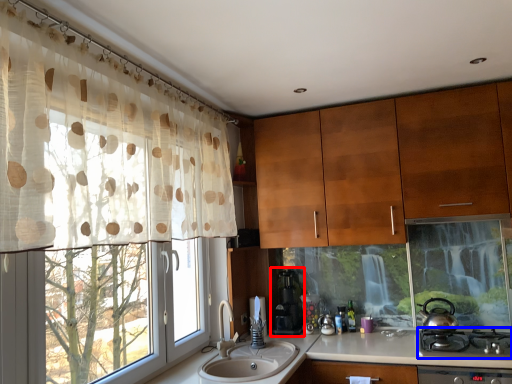
Question: Among these objects, which one is nearest to the camera, coffee machine (highlighted by a red box) or gas stove (highlighted by a blue box)?

Choices:
 (A) coffee machine
 (B) gas stove

Answer: (B)